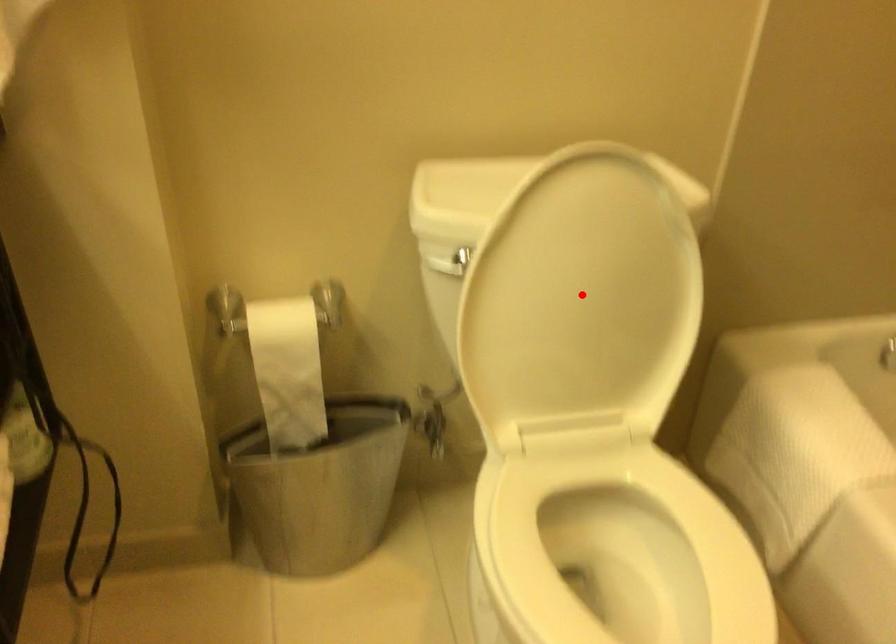
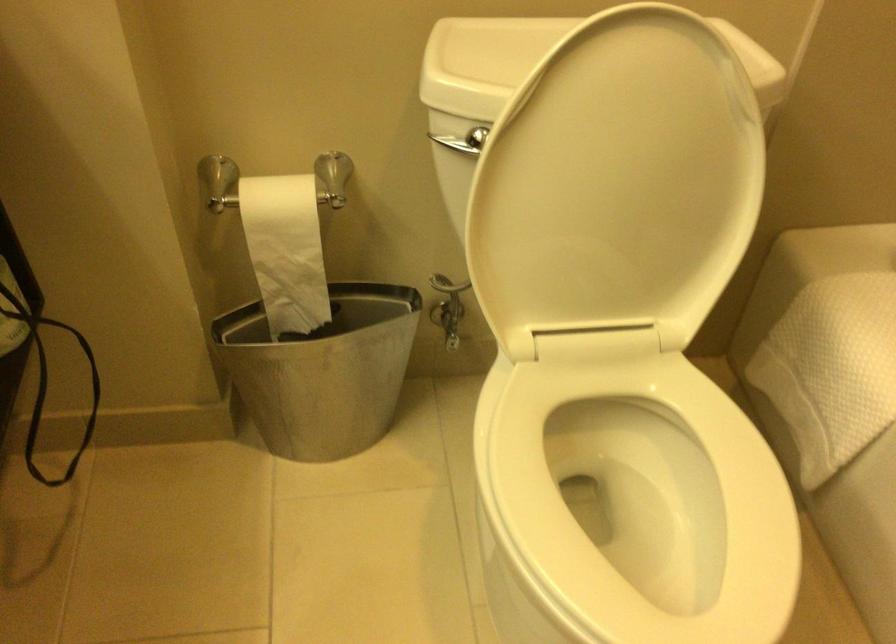
In the second image, find the point that corresponds to the highlighted location in the first image.

(617, 183)